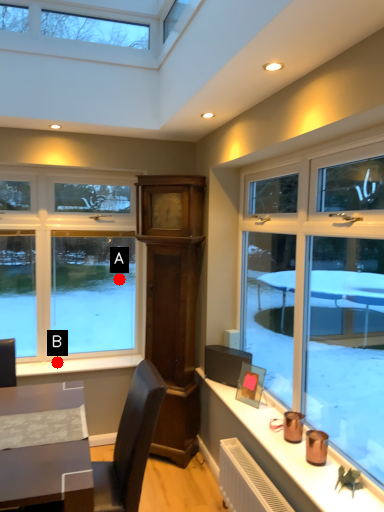
Question: Two points are circled on the image, labeled by A and B beside each circle. Which point appears farthest from the camera in this image?

Choices:
 (A) A is further
 (B) B is further

Answer: (A)